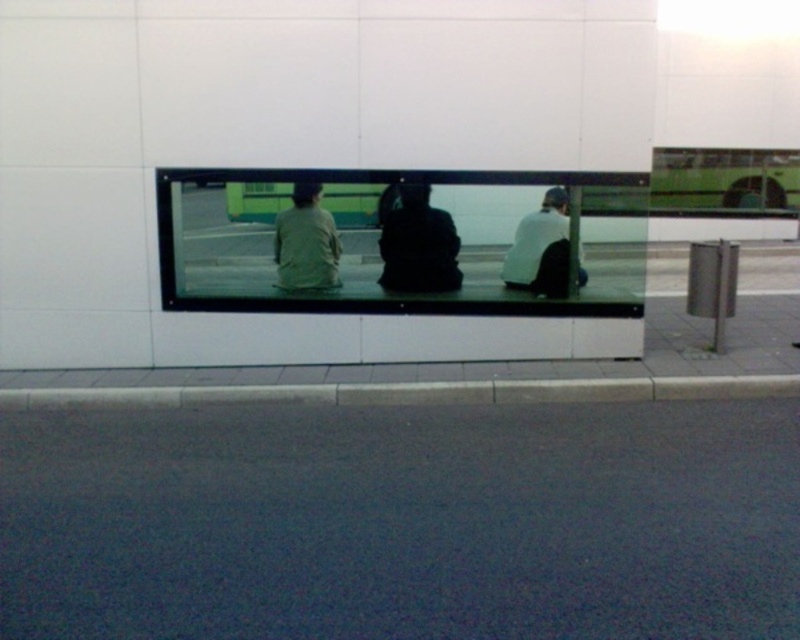
Measure the distance between light gray fabric jacket at center and camera.

They are 7.73 meters apart.

This screenshot has height=640, width=800. I want to click on light gray fabric jacket at center, so click(306, 243).

Is dark matte jacket at center closer to the viewer compared to light gray fabric jacket at center?

Yes, dark matte jacket at center is in front of light gray fabric jacket at center.

Does point (420, 276) come in front of point (282, 230)?

No, (420, 276) is further to viewer.

Between point (425, 269) and point (318, 196), which one is positioned behind?

The point (425, 269) is more distant.

At what (x,y) coordinates should I click in order to perform the action: click on dark matte jacket at center. Please return your answer as a coordinate pair (x, y). The width and height of the screenshot is (800, 640). Looking at the image, I should click on (418, 243).

Which is behind, point (417, 291) or point (502, 269)?

The point (502, 269) is behind.

Can you confirm if dark matte jacket at center is smaller than white matte jacket at center?

Correct, dark matte jacket at center occupies less space than white matte jacket at center.

I want to click on dark matte jacket at center, so click(418, 243).